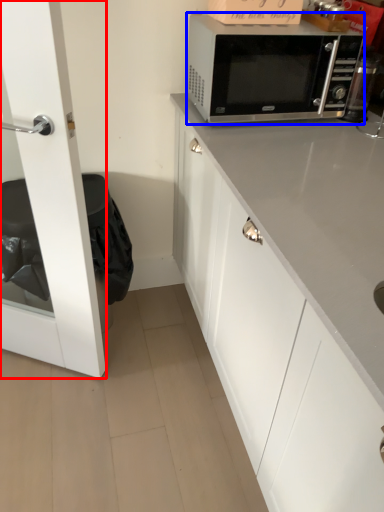
Question: Which of the following is the farthest to the observer, glass door (highlighted by a red box) or microwave oven (highlighted by a blue box)?

Choices:
 (A) glass door
 (B) microwave oven

Answer: (B)